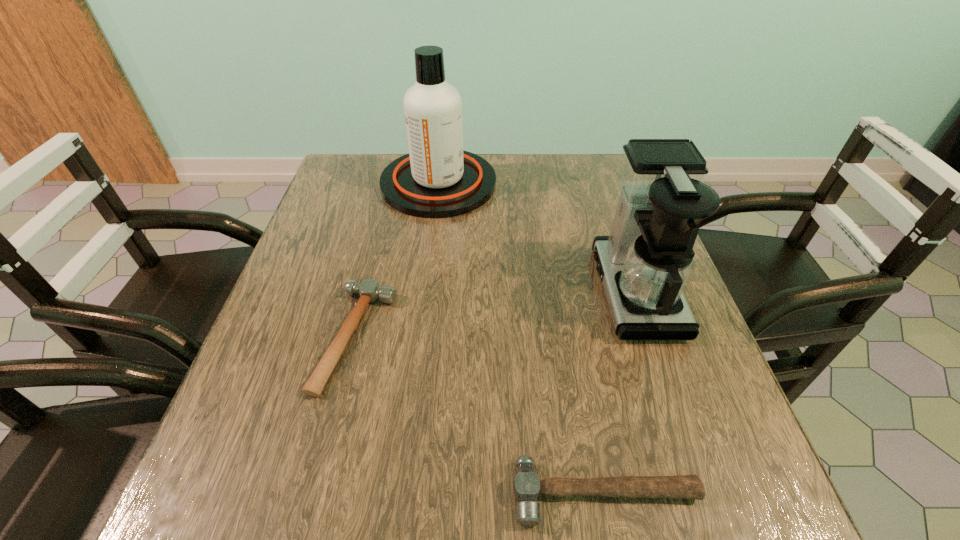
Locate an element on the screen. This screenshot has width=960, height=540. the farthest object is located at coordinates (437, 179).

Locate an element on the screen. The image size is (960, 540). the tallest object is located at coordinates (437, 179).

This screenshot has height=540, width=960. What are the coordinates of `coffee maker` in the screenshot? It's located at pos(645,263).

At what (x,y) coordinates should I click in order to perform the action: click on the farther hammer. Please return your answer as a coordinate pair (x, y). Image resolution: width=960 pixels, height=540 pixels. Looking at the image, I should click on (370, 291).

At what (x,y) coordinates should I click in order to perform the action: click on the nearer hammer. Please return your answer as a coordinate pair (x, y). The height and width of the screenshot is (540, 960). Looking at the image, I should click on (526, 486).

Find the location of `the right hammer`. the right hammer is located at coordinates (526, 486).

Locate an element on the screen. This screenshot has width=960, height=540. vacant region located on the right of the farthest object is located at coordinates (592, 184).

Identify the location of blank area located 0.080m at the front of the coffee maker where the controls are located. (561, 292).

You are a GUI agent. You are given a task and a screenshot of the screen. Output one action in this format:
    pyautogui.click(x=<x>, y=<y>)
    Task: Click on the vacant space located at the front of the coffee maker where the controls are located
    The image size is (960, 540).
    Given the screenshot: What is the action you would take?
    pyautogui.click(x=434, y=292)

This screenshot has height=540, width=960. I want to click on vacant space situated at the front of the coffee maker where the controls are located, so click(x=439, y=292).